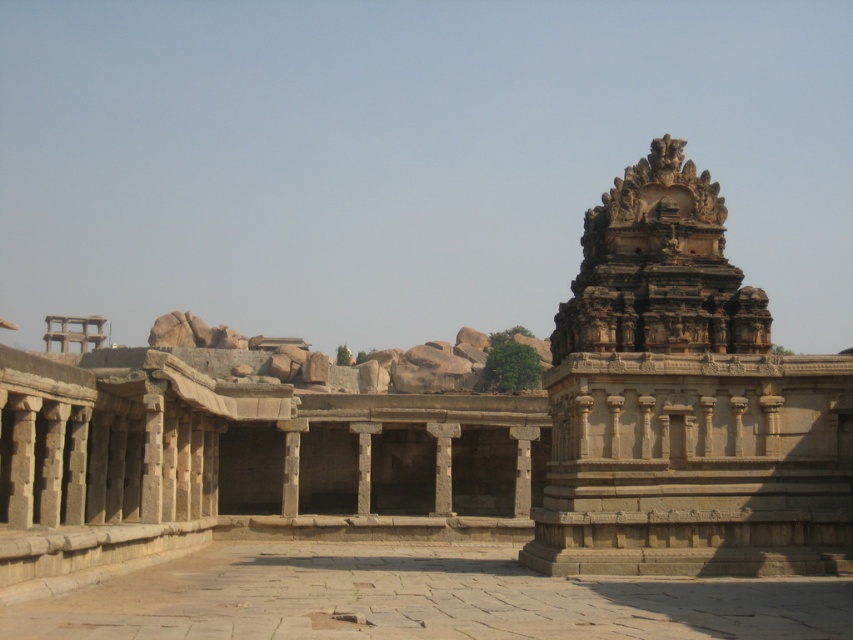
You are standing at the center of the ancient stone structure. There is a point marked at coordinates (685, 403). What is located at that point?

The stone temple at right is located at point (685, 403).

You are standing at the entrance of the ancient stone structure and want to take a photo of a specific point in the scene. The point you want to capture is labeled as point (245, 429). Considering your camera can focus on objects within 100 meters, will you be able to capture this point clearly?

The distance of point (245, 429) from the camera is 97.23 meters, which is within the camera focus range of 100 meters. Therefore, the camera can capture the point clearly.

In the scene shown: You are standing at the entrance of the ancient stone structure and want to take a photo that includes both the stone temple at center and the stone temple at right. Based on their positions, which temple should you focus on first to ensure both are in the frame?

The stone temple at center is above the stone temple at right, so you should focus on the stone temple at center first to ensure both are in the frame.